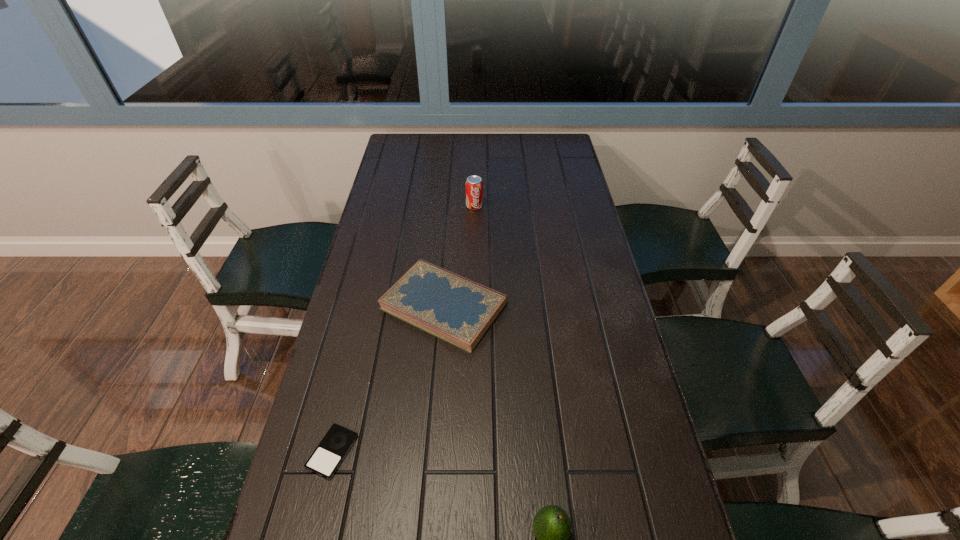
The image size is (960, 540). In order to click on vacant space that satisfies the following two spatial constraints: 1. on the back side of the third nearest object; 2. on the right side of the iPod in this screenshot , I will do `click(368, 306)`.